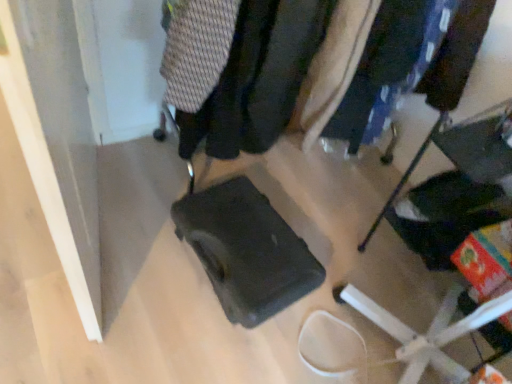
Question: Is matte black suitcase at center inside the boundaries of matte black backpack at center, which is the second clothing from left to right, or outside?

Choices:
 (A) inside
 (B) outside

Answer: (B)

Question: In terms of width, does matte black suitcase at center look wider or thinner when compared to matte black backpack at center, marked as the 1th clothing in a right-to-left arrangement?

Choices:
 (A) wide
 (B) thin

Answer: (A)

Question: Which is farther from the knitted fabric sweater at upper center, which is the 1th clothing in left-to-right order?

Choices:
 (A) matte black suitcase at center
 (B) matte black suitcase at center
 (C) matte black suitcase at center
 (D) matte black backpack at center, which is the second clothing from left to right

Answer: (B)

Question: Based on their relative distances, which object is farther from the knitted fabric sweater at upper center, the second clothing positioned from the right?

Choices:
 (A) matte black suitcase at center
 (B) matte black backpack at center, which is the second clothing from left to right
 (C) matte black suitcase at center
 (D) matte black suitcase at center

Answer: (A)